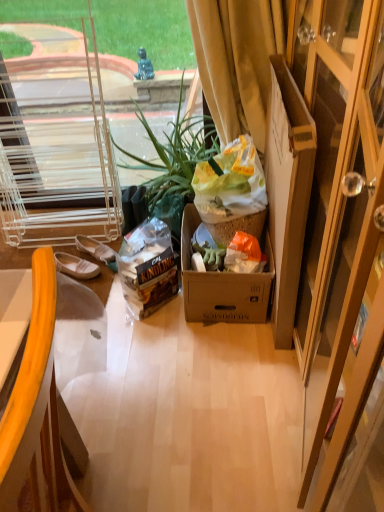
This screenshot has height=512, width=384. I want to click on green leafy plant at center, so click(176, 154).

Describe the element at coordinates (238, 60) in the screenshot. The image size is (384, 512). I see `yellow velvet curtain at upper right` at that location.

Image resolution: width=384 pixels, height=512 pixels. In order to click on white canvas slipper at lower left in this screenshot , I will do tap(75, 266).

The height and width of the screenshot is (512, 384). In order to click on white fabric shoe at left in this screenshot , I will do `click(95, 249)`.

The height and width of the screenshot is (512, 384). What do you see at coordinates (95, 249) in the screenshot?
I see `white fabric shoe at left` at bounding box center [95, 249].

I want to click on green leafy plant at center, so click(176, 154).

Considering the sizes of objects white fabric shoe at left and green leafy plant at center in the image provided, who is shorter, white fabric shoe at left or green leafy plant at center?

white fabric shoe at left.

Is green leafy plant at center located within white fabric shoe at left?

That's incorrect, green leafy plant at center is not inside white fabric shoe at left.

Consider the image. Is white fabric shoe at left not close to green leafy plant at center?

No, there isn't a large distance between white fabric shoe at left and green leafy plant at center.

Which object is positioned more to the left, white fabric shoe at left or green leafy plant at center?

Positioned to the left is white fabric shoe at left.

From the image's perspective, which one is positioned higher, yellow plastic chair at left or yellow velvet curtain at upper right?

yellow velvet curtain at upper right is shown above in the image.

Looking at this image, is yellow plastic chair at left smaller than yellow velvet curtain at upper right?

No, yellow plastic chair at left is not smaller than yellow velvet curtain at upper right.

Does point (56, 501) lie behind point (233, 113)?

No, it is in front of (233, 113).

Does cardboard box at right have a lesser height compared to green leafy plant at center?

In fact, cardboard box at right may be taller than green leafy plant at center.

Considering the relative sizes of cardboard box at right and green leafy plant at center in the image provided, is cardboard box at right thinner than green leafy plant at center?

Indeed, cardboard box at right has a lesser width compared to green leafy plant at center.

Is white canvas slipper at lower left taller than white fabric shoe at left?

No, white canvas slipper at lower left is not taller than white fabric shoe at left.

Is white canvas slipper at lower left further to the viewer compared to white fabric shoe at left?

No, white canvas slipper at lower left is in front of white fabric shoe at left.

Is white canvas slipper at lower left in contact with white fabric shoe at left?

Yes, white canvas slipper at lower left is next to white fabric shoe at left.

Is point (252, 75) positioned before point (62, 253)?

That is True.

Who is smaller, yellow velvet curtain at upper right or white canvas slipper at lower left?

white canvas slipper at lower left is smaller.

From the picture: From a real-world perspective, is yellow velvet curtain at upper right physically located above or below white canvas slipper at lower left?

In terms of real-world spatial position, yellow velvet curtain at upper right is above white canvas slipper at lower left.

Considering the relative positions of yellow velvet curtain at upper right and white canvas slipper at lower left in the image provided, is yellow velvet curtain at upper right to the left or to the right of white canvas slipper at lower left?

Clearly, yellow velvet curtain at upper right is on the right of white canvas slipper at lower left in the image.

Would you say yellow velvet curtain at upper right is inside or outside green leafy plant at center?

yellow velvet curtain at upper right is located beyond the bounds of green leafy plant at center.

From a real-world perspective, which is physically above, yellow velvet curtain at upper right or green leafy plant at center?

yellow velvet curtain at upper right, from a real-world perspective.

In terms of height, does yellow velvet curtain at upper right look taller or shorter compared to green leafy plant at center?

In the image, yellow velvet curtain at upper right appears to be shorter than green leafy plant at center.

Considering the sizes of objects yellow velvet curtain at upper right and green leafy plant at center in the image provided, who is bigger, yellow velvet curtain at upper right or green leafy plant at center?

green leafy plant at center is bigger.

Looking at this image, does yellow velvet curtain at upper right have a greater height compared to white fabric shoe at left?

Indeed, yellow velvet curtain at upper right has a greater height compared to white fabric shoe at left.

How distant is yellow velvet curtain at upper right from white fabric shoe at left?

yellow velvet curtain at upper right and white fabric shoe at left are 38.21 inches apart.

Considering the sizes of yellow velvet curtain at upper right and white fabric shoe at left in the image, is yellow velvet curtain at upper right bigger or smaller than white fabric shoe at left?

Clearly, yellow velvet curtain at upper right is larger in size than white fabric shoe at left.

From the image's perspective, between yellow velvet curtain at upper right and white fabric shoe at left, who is located below?

white fabric shoe at left, from the image's perspective.

This screenshot has width=384, height=512. I want to click on footwear located behind the green leafy plant at center, so click(95, 249).

Locate an element on the screen. The width and height of the screenshot is (384, 512). chair on the left of yellow velvet curtain at upper right is located at coordinates (37, 411).

Considering their positions, is yellow plastic chair at left positioned further to green leafy plant at center than white canvas slipper at lower left?

Among the two, yellow plastic chair at left is located further to green leafy plant at center.

Based on their spatial positions, is green leafy plant at center or yellow plastic chair at left further from white fabric shoe at left?

Based on the image, yellow plastic chair at left appears to be further to white fabric shoe at left.

From the image, which object appears to be farther from white fabric shoe at left, green leafy plant at center or yellow velvet curtain at upper right?

yellow velvet curtain at upper right.

Considering their positions, is yellow plastic chair at left positioned further to white canvas slipper at lower left than white fabric shoe at left?

yellow plastic chair at left is positioned further to the anchor white canvas slipper at lower left.

From the image, which object appears to be nearer to yellow velvet curtain at upper right, cardboard box at right or white canvas slipper at lower left?

The object closer to yellow velvet curtain at upper right is cardboard box at right.

Which object lies further to the anchor point white fabric shoe at left, yellow plastic chair at left or green leafy plant at center?

yellow plastic chair at left lies further to white fabric shoe at left than the other object.

When comparing their distances from white canvas slipper at lower left, does cardboard box at right or green leafy plant at center seem further?

The object further to white canvas slipper at lower left is cardboard box at right.

From the image, which object appears to be nearer to cardboard box at right, yellow plastic chair at left or yellow velvet curtain at upper right?

Based on the image, yellow velvet curtain at upper right appears to be nearer to cardboard box at right.

Image resolution: width=384 pixels, height=512 pixels. Identify the location of curtain positioned between yellow plastic chair at left and green leafy plant at center from near to far. (238, 60).

Find the location of a particular element. The width and height of the screenshot is (384, 512). footwear between green leafy plant at center and white canvas slipper at lower left from top to bottom is located at coordinates (95, 249).

I want to click on slippers located between yellow plastic chair at left and white fabric shoe at left in the depth direction, so click(x=75, y=266).

At what (x,y) coordinates should I click in order to perform the action: click on houseplant between yellow velvet curtain at upper right and white fabric shoe at left from front to back. Please return your answer as a coordinate pair (x, y). The image size is (384, 512). Looking at the image, I should click on (176, 154).